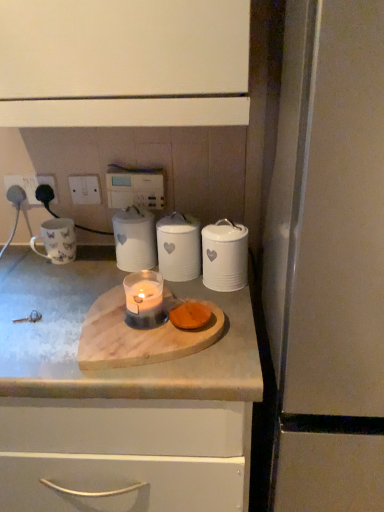
Locate an element on the screen. free area in between wooden cutting board at center and matte white mug at left is located at coordinates click(x=72, y=284).